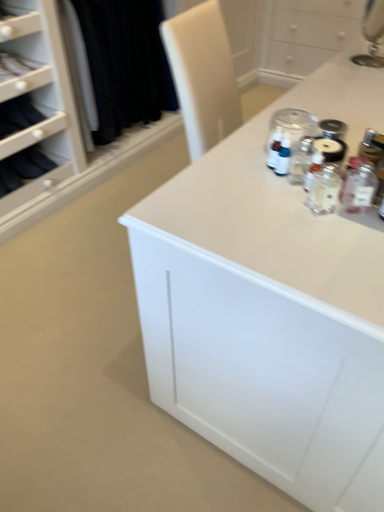
Question: Considering the relative sizes of clear glass bottle at center, acting as the second bottle starting from the right, and clear glass bottle at right, the 1th bottle in the right-to-left sequence, in the image provided, is clear glass bottle at center, acting as the second bottle starting from the right, smaller than clear glass bottle at right, the 1th bottle in the right-to-left sequence,?

Choices:
 (A) yes
 (B) no

Answer: (A)

Question: Is clear glass bottle at center, acting as the second bottle starting from the right, facing towards clear glass bottle at right, positioned as the second bottle in left-to-right order?

Choices:
 (A) no
 (B) yes

Answer: (A)

Question: From a real-world perspective, is clear glass bottle at center, acting as the second bottle starting from the right, physically above clear glass bottle at right, positioned as the second bottle in left-to-right order?

Choices:
 (A) no
 (B) yes

Answer: (A)

Question: Can you confirm if clear glass bottle at center, acting as the second bottle starting from the right, is positioned to the left of clear glass bottle at right, the 1th bottle in the right-to-left sequence?

Choices:
 (A) no
 (B) yes

Answer: (B)

Question: Is clear glass bottle at center, which is the first bottle in left-to-right order, at the right side of clear glass bottle at right, the 1th bottle in the right-to-left sequence?

Choices:
 (A) no
 (B) yes

Answer: (A)

Question: From their relative heights in the image, would you say white glossy countertop at upper right is taller or shorter than clear glass bottle at right, the 1th bottle in the right-to-left sequence?

Choices:
 (A) tall
 (B) short

Answer: (B)

Question: From a real-world perspective, is white glossy countertop at upper right positioned above or below clear glass bottle at right, positioned as the second bottle in left-to-right order?

Choices:
 (A) above
 (B) below

Answer: (B)

Question: Looking at their shapes, would you say white glossy countertop at upper right is wider or thinner than clear glass bottle at right, the 1th bottle in the right-to-left sequence?

Choices:
 (A) wide
 (B) thin

Answer: (A)

Question: Is white glossy countertop at upper right inside or outside of clear glass bottle at right, positioned as the second bottle in left-to-right order?

Choices:
 (A) outside
 (B) inside

Answer: (A)

Question: From the image's perspective, is white glossy countertop at upper right above or below matte black fabric at upper left?

Choices:
 (A) below
 (B) above

Answer: (A)

Question: Is point (198, 196) positioned closer to the camera than point (21, 77)?

Choices:
 (A) farther
 (B) closer

Answer: (B)

Question: From their relative heights in the image, would you say white glossy countertop at upper right is taller or shorter than matte black fabric at upper left?

Choices:
 (A) short
 (B) tall

Answer: (A)

Question: Is white glossy countertop at upper right situated inside matte black fabric at upper left or outside?

Choices:
 (A) outside
 (B) inside

Answer: (A)

Question: From the image's perspective, relative to clear glass bottle at right, positioned as the second bottle in left-to-right order, is clear glass bottle at center, which is the first bottle in left-to-right order, above or below?

Choices:
 (A) above
 (B) below

Answer: (B)

Question: Is clear glass bottle at center, which is the first bottle in left-to-right order, bigger or smaller than clear glass bottle at right, positioned as the second bottle in left-to-right order?

Choices:
 (A) big
 (B) small

Answer: (B)